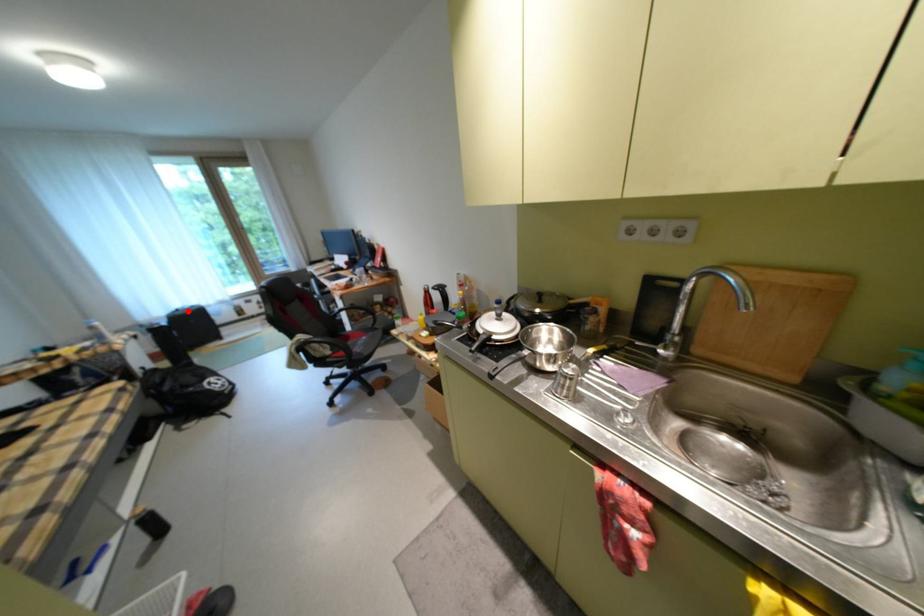
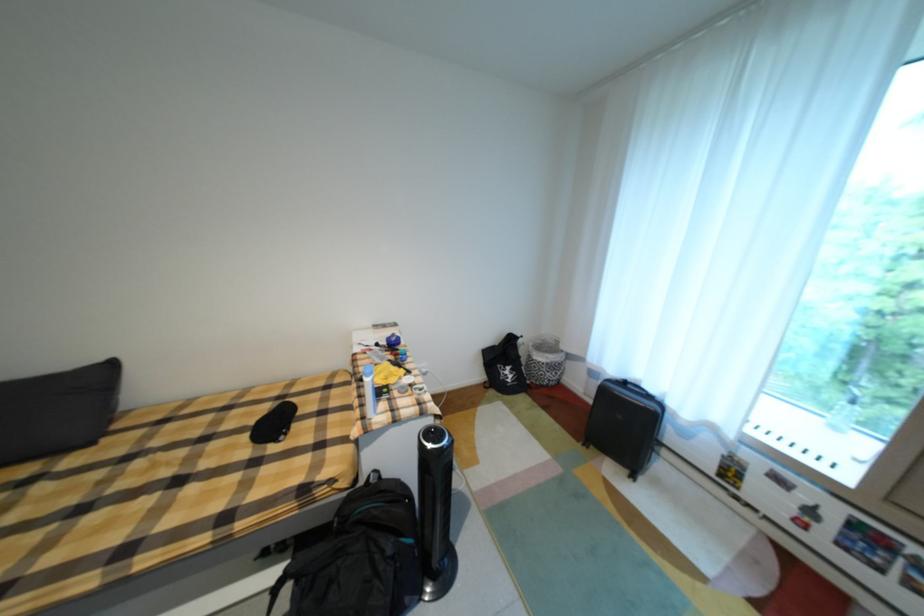
Where in the second image is the point corresponding to the highlighted location from the first image?

(635, 384)